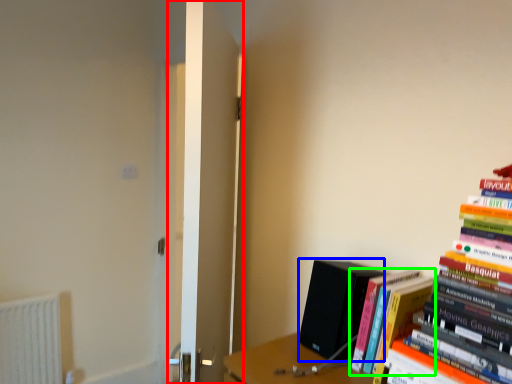
Question: Estimate the real-world distances between objects in this image. Which object is farther from door (highlighted by a red box), paperback book (highlighted by a blue box) or book (highlighted by a green box)?

Choices:
 (A) paperback book
 (B) book

Answer: (B)